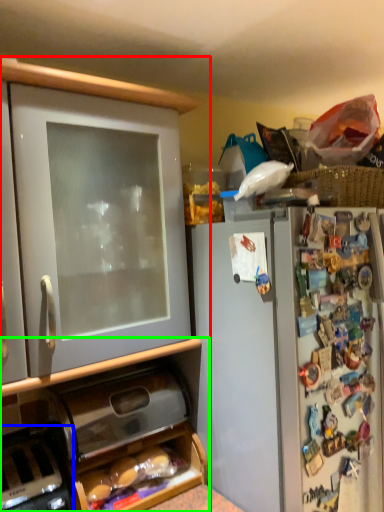
Question: Which object is the closest to the cabinetry (highlighted by a red box)? Choose among these: appliance (highlighted by a blue box) or cabinetry (highlighted by a green box).

Choices:
 (A) appliance
 (B) cabinetry

Answer: (B)